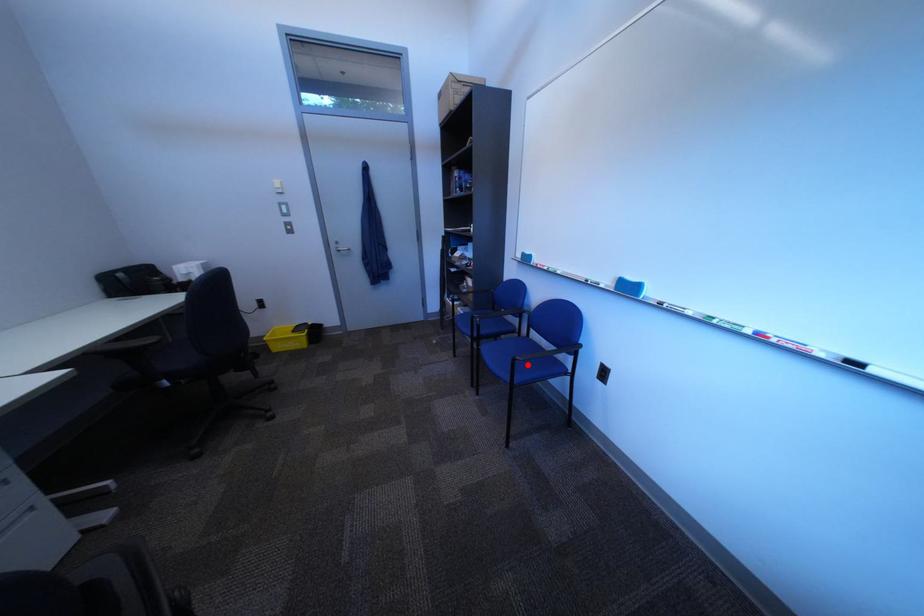
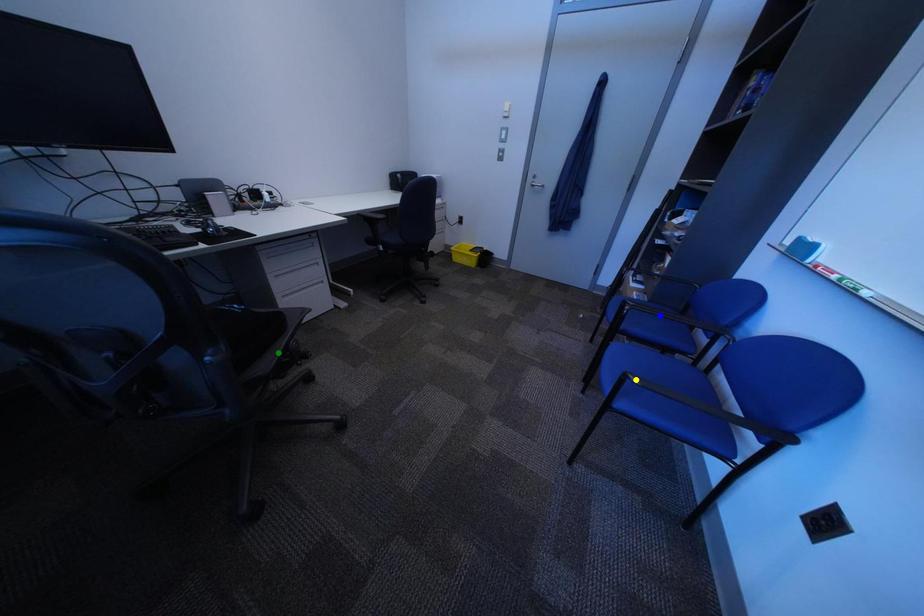
Question: I am providing you with two images of the same scene from different viewpoints. A red point is marked on the first image. You are given multiple points on the second image. In image 2, which mark is for the same physical point as the one in image 1?

Choices:
 (A) blue point
 (B) yellow point
 (C) green point

Answer: (B)